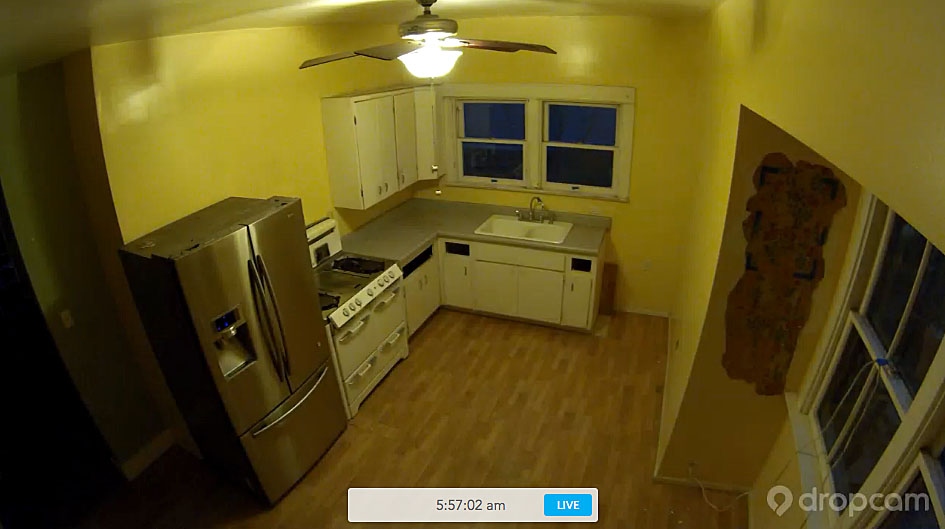
Where is `fridge`? fridge is located at coordinates (275, 276).